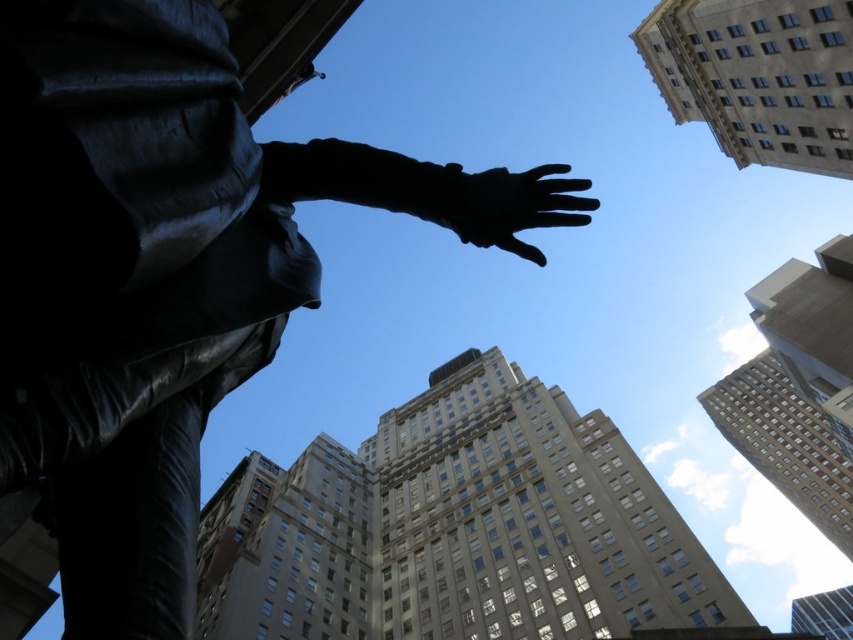
You are a photographer standing on the ground floor of the building. You want to take a photo that includes both the black polished statue at center and the black matte hand at upper center. Based on their positions, which object should you adjust your camera to focus on first to ensure both are in the frame?

The black polished statue at center is to the left of black matte hand at upper center. To include both in the frame, focus on the black polished statue at center first since it is positioned to the left, allowing the hand to be captured to its right within the same shot.

You are standing in the plaza below the statue and want to touch both the black polished statue at center and the black matte hand at upper center. Given that your maximum reach is 6 feet, can you touch both without moving your position?

The black polished statue at center is 9.09 feet away from the black matte hand at upper center. Since your maximum reach is 6 feet, you cannot touch both the black polished statue at center and the black matte hand at upper center without moving your position because the distance between them exceeds your reach.

You are standing in the city square and want to take a photo of both the black polished statue at center and the black matte hand at upper center. However, you notice that the statue is blocking part of the hand. Can you still capture both objects fully in your photo without any obstruction?

The black polished statue at center is closer to the viewer than the black matte hand at upper center. Since the statue is closer, it might block the view of the hand. To capture both fully, you might need to adjust your position to ensure the statue doesn not obstruct the hand.